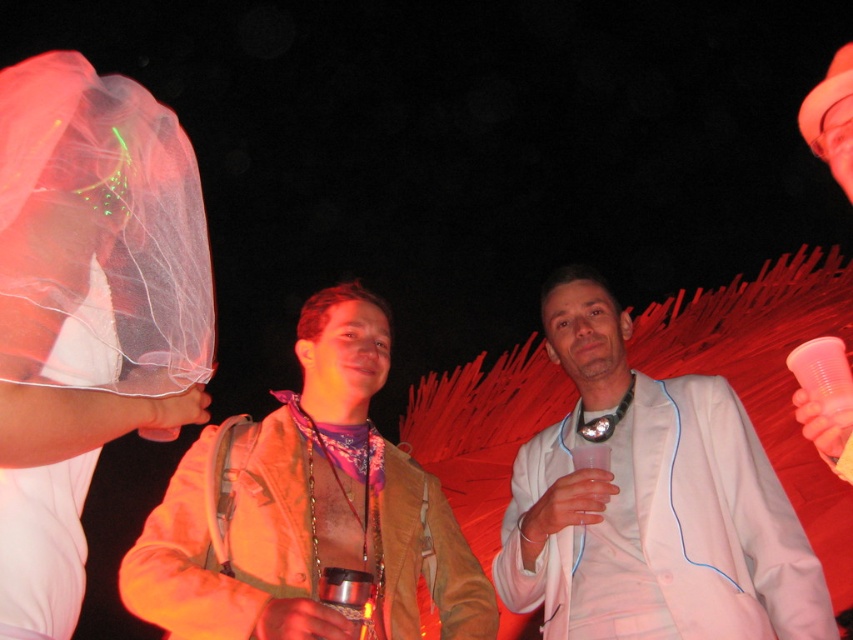
You are at a party and need to find the person wearing the brown leather jacket at center. Which direction should you look from the white matte suit at center?

The brown leather jacket at center is to the left of the white matte suit at center, so you should look to the left from the white matte suit at center to find the brown leather jacket at center.